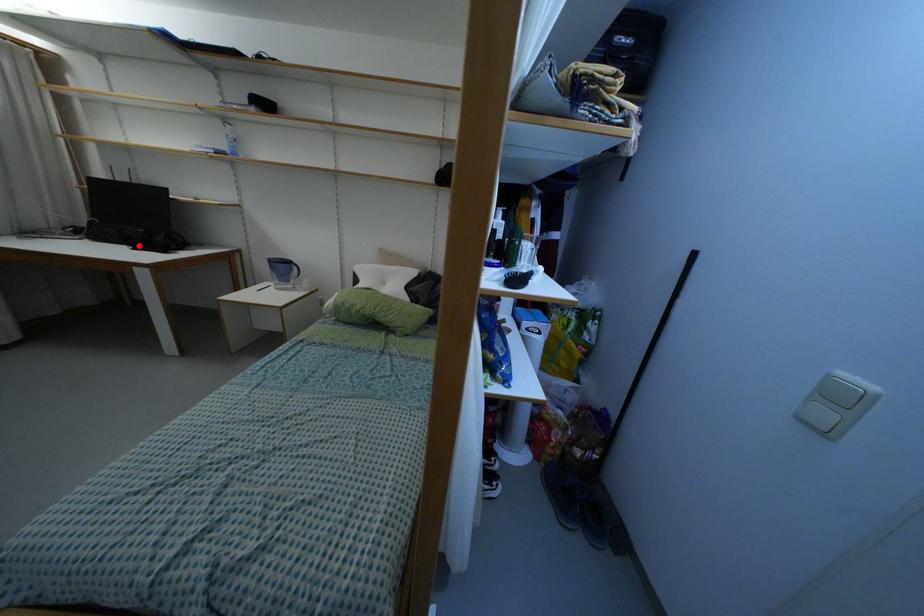
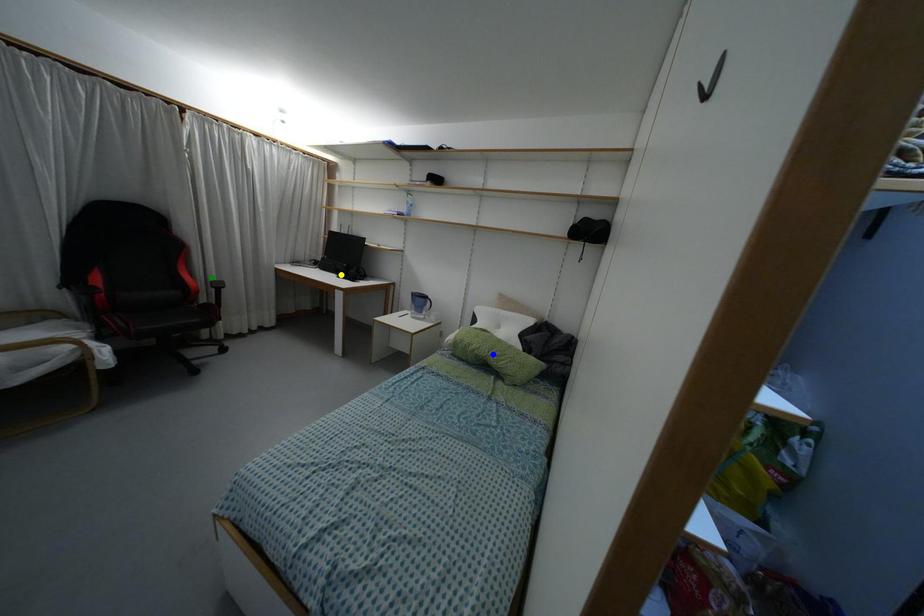
Question: I am providing you with two images of the same scene from different viewpoints. A red point is marked on the first image. You are given multiple points on the second image. In image 2, which mark is for the same physical point as the one in image 1?

Choices:
 (A) green point
 (B) yellow point
 (C) blue point

Answer: (B)